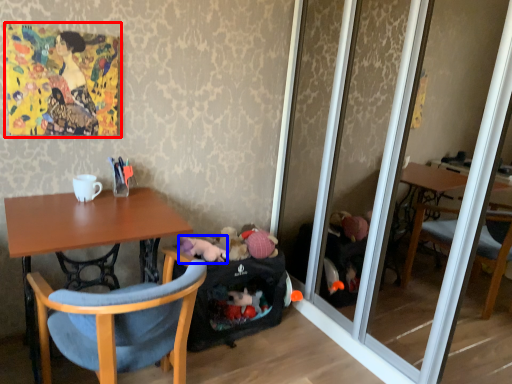
Question: Which of the following is the farthest to the observer, picture frame (highlighted by a red box) or animal (highlighted by a blue box)?

Choices:
 (A) picture frame
 (B) animal

Answer: (B)